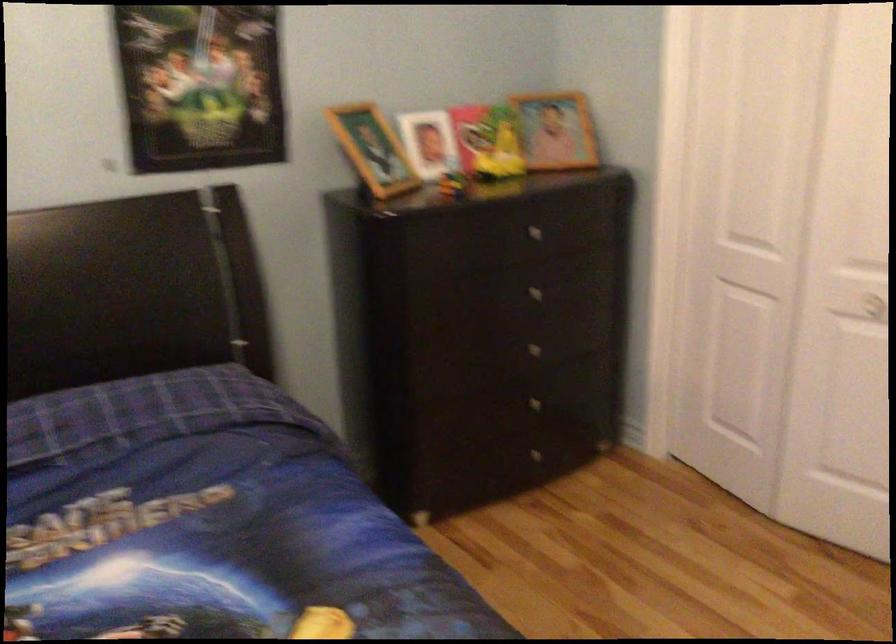
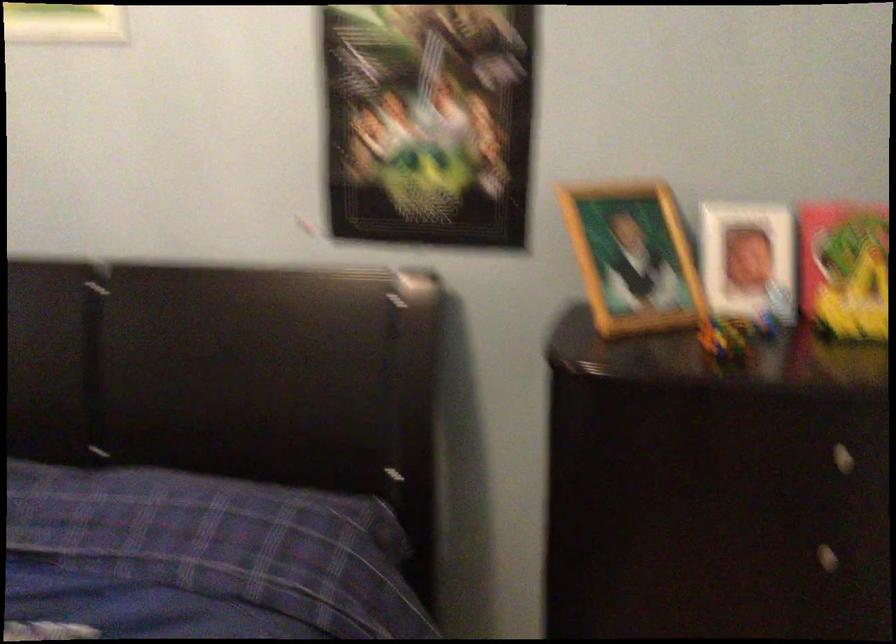
Where in the second image is the point corresponding to [374,147] from the first image?

(633, 258)